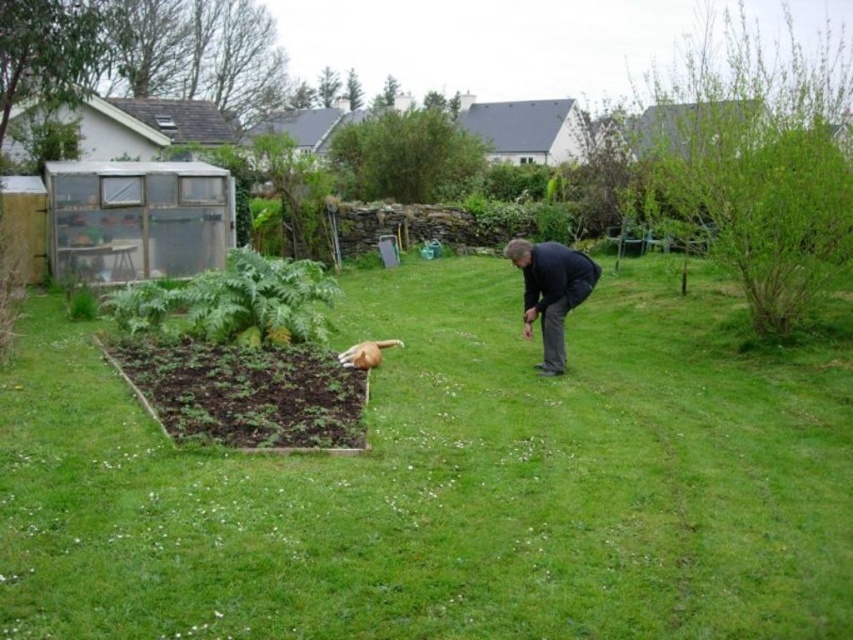
Does green grass at center appear over dark blue jacket at center?

No.

At what (x,y) coordinates should I click in order to perform the action: click on green grass at center. Please return your answer as a coordinate pair (x, y). Looking at the image, I should click on (451, 481).

Is point (535, 426) farther from camera compared to point (566, 248)?

No, (535, 426) is in front of (566, 248).

This screenshot has height=640, width=853. In order to click on green grass at center in this screenshot , I will do (451, 481).

Between dark blue jacket at center and brown fur dog at lower center, which one is positioned higher?

dark blue jacket at center

Is dark blue jacket at center further to the viewer compared to brown fur dog at lower center?

Yes, dark blue jacket at center is further from the viewer.

Where is `dark blue jacket at center`? This screenshot has height=640, width=853. dark blue jacket at center is located at coordinates (550, 291).

Is green grass at center below brown fur dog at lower center?

No.

Is point (67, 369) positioned before point (364, 342)?

Yes.

Image resolution: width=853 pixels, height=640 pixels. Identify the location of green grass at center. (451, 481).